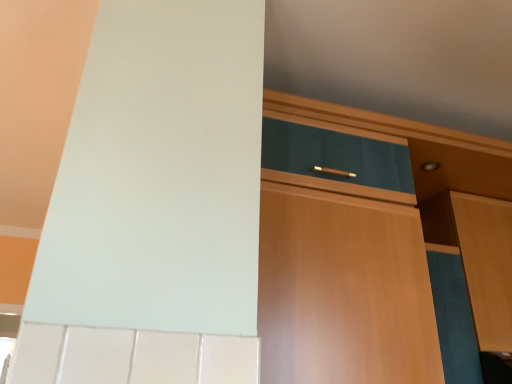
Question: From the image's perspective, does wooden cabinet at right, placed as the 1th cabinetry when sorted from right to left, appear lower than wooden cabinet at center, the second cabinetry viewed from the right?

Choices:
 (A) yes
 (B) no

Answer: (A)

Question: Can you confirm if wooden cabinet at right, placed as the 1th cabinetry when sorted from right to left, is bigger than wooden cabinet at center, the first cabinetry from the left?

Choices:
 (A) no
 (B) yes

Answer: (A)

Question: Is wooden cabinet at right, arranged as the second cabinetry when viewed from the left, at the right side of wooden cabinet at center, the first cabinetry from the left?

Choices:
 (A) no
 (B) yes

Answer: (B)

Question: Is wooden cabinet at right, arranged as the second cabinetry when viewed from the left, not near wooden cabinet at center, the second cabinetry viewed from the right?

Choices:
 (A) no
 (B) yes

Answer: (A)

Question: Is wooden cabinet at right, placed as the 1th cabinetry when sorted from right to left, looking in the opposite direction of wooden cabinet at center, the second cabinetry viewed from the right?

Choices:
 (A) no
 (B) yes

Answer: (A)

Question: Would you say wooden cabinet at center, the second cabinetry viewed from the right, is part of wooden cabinet at right, arranged as the second cabinetry when viewed from the left,'s contents?

Choices:
 (A) yes
 (B) no

Answer: (B)

Question: From a real-world perspective, is wooden cabinet at center, the first cabinetry from the left, below wooden cabinet at right, arranged as the second cabinetry when viewed from the left?

Choices:
 (A) yes
 (B) no

Answer: (A)

Question: Is wooden cabinet at center, the second cabinetry viewed from the right, to the left of wooden cabinet at right, placed as the 1th cabinetry when sorted from right to left, from the viewer's perspective?

Choices:
 (A) yes
 (B) no

Answer: (A)

Question: Is wooden cabinet at center, the second cabinetry viewed from the right, to the right of wooden cabinet at right, arranged as the second cabinetry when viewed from the left, from the viewer's perspective?

Choices:
 (A) yes
 (B) no

Answer: (B)

Question: Can you confirm if wooden cabinet at center, the first cabinetry from the left, is bigger than wooden cabinet at right, arranged as the second cabinetry when viewed from the left?

Choices:
 (A) yes
 (B) no

Answer: (A)

Question: Is wooden cabinet at right, arranged as the second cabinetry when viewed from the left, at the back of wooden cabinet at center, the second cabinetry viewed from the right?

Choices:
 (A) yes
 (B) no

Answer: (B)

Question: Is wooden cabinet at center, the second cabinetry viewed from the right, located outside wooden cabinet at right, arranged as the second cabinetry when viewed from the left?

Choices:
 (A) yes
 (B) no

Answer: (A)

Question: From a real-world perspective, relative to wooden cabinet at center, the first cabinetry from the left, is wooden cabinet at right, arranged as the second cabinetry when viewed from the left, vertically above or below?

Choices:
 (A) above
 (B) below

Answer: (A)